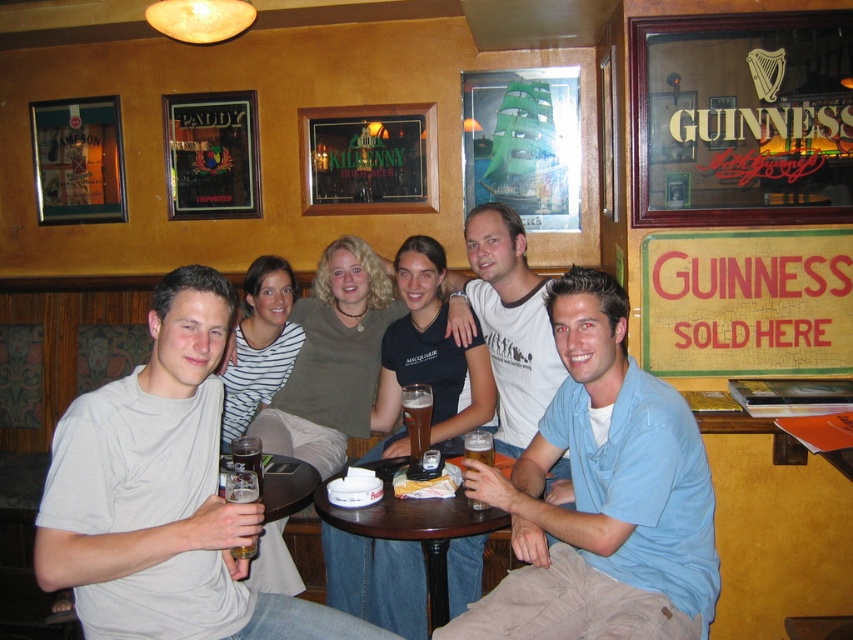
Question: Is light gray t-shirt at center to the left of white cotton t-shirt at center from the viewer's perspective?

Choices:
 (A) no
 (B) yes

Answer: (B)

Question: Can you confirm if light gray t-shirt at center is smaller than brown glass beer at center?

Choices:
 (A) no
 (B) yes

Answer: (A)

Question: Which object is closer to the camera taking this photo?

Choices:
 (A) blue cotton shirt at center
 (B) brown glass beer at center

Answer: (A)

Question: Is the position of light gray t-shirt at center more distant than that of brown glass beer at center?

Choices:
 (A) no
 (B) yes

Answer: (A)

Question: Which point is farther to the camera?

Choices:
 (A) (566, 385)
 (B) (508, 321)

Answer: (B)

Question: Which point appears farthest from the camera in this image?

Choices:
 (A) (106, 387)
 (B) (473, 531)

Answer: (B)